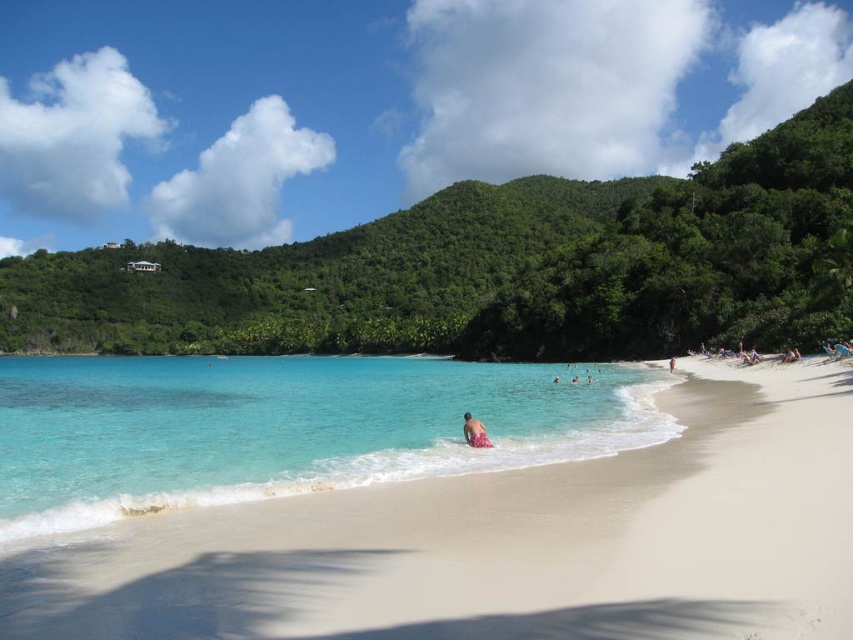
Can you confirm if clear blue water at center is positioned to the left of pink fabric at lower center?

Correct, you'll find clear blue water at center to the left of pink fabric at lower center.

Is clear blue water at center positioned before pink fabric at lower center?

Yes, it is.

This screenshot has width=853, height=640. Identify the location of clear blue water at center. (285, 428).